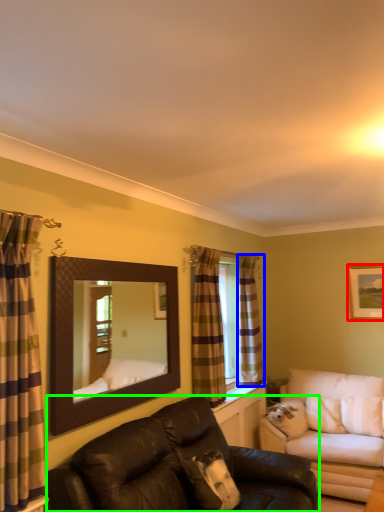
Question: Based on their relative distances, which object is nearer to picture frame (highlighted by a red box)? Choose from curtain (highlighted by a blue box) and studio couch (highlighted by a green box).

Choices:
 (A) curtain
 (B) studio couch

Answer: (A)